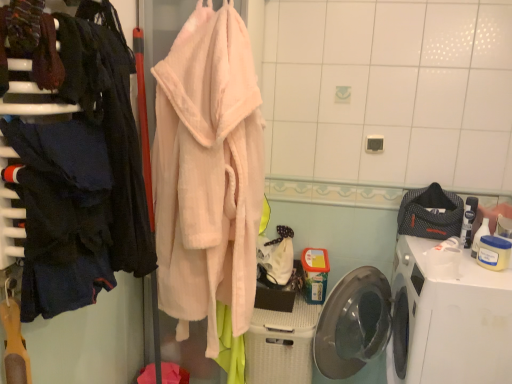
Question: Is white plastic washing machine at lower right inside dark blue fabric at left, marked as the first clothing in a left-to-right arrangement?

Choices:
 (A) yes
 (B) no

Answer: (B)

Question: Is dark blue fabric at left, which ranks as the second clothing in back-to-front order, facing towards white plastic washing machine at lower right?

Choices:
 (A) yes
 (B) no

Answer: (B)

Question: Would you say dark blue fabric at left, the 2th clothing positioned from the right, is outside white plastic washing machine at lower right?

Choices:
 (A) yes
 (B) no

Answer: (A)

Question: Is dark blue fabric at left, marked as the first clothing in a left-to-right arrangement, positioned before white plastic washing machine at lower right?

Choices:
 (A) no
 (B) yes

Answer: (B)

Question: Is dark blue fabric at left, which ranks as the first clothing in front-to-back order, directly adjacent to white plastic washing machine at lower right?

Choices:
 (A) yes
 (B) no

Answer: (B)

Question: Is dark blue fabric at left, the 2th clothing positioned from the right, oriented away from white plastic washing machine at lower right?

Choices:
 (A) no
 (B) yes

Answer: (A)

Question: Does dark blue fabric at left, which is the first closet from front to back, touch soft pink plush robe at center, acting as the 2th closet starting from the front?

Choices:
 (A) yes
 (B) no

Answer: (B)

Question: Is dark blue fabric at left, which is the first closet from front to back, thinner than soft pink plush robe at center, which is counted as the 1th closet, starting from the back?

Choices:
 (A) yes
 (B) no

Answer: (A)

Question: Considering the relative positions of dark blue fabric at left, which is the first closet from front to back, and soft pink plush robe at center, which is counted as the 1th closet, starting from the back, in the image provided, is dark blue fabric at left, which is the first closet from front to back, to the left of soft pink plush robe at center, which is counted as the 1th closet, starting from the back, from the viewer's perspective?

Choices:
 (A) no
 (B) yes

Answer: (B)

Question: Considering the relative sizes of dark blue fabric at left, the second closet when ordered from back to front, and soft pink plush robe at center, which is counted as the 1th closet, starting from the back, in the image provided, is dark blue fabric at left, the second closet when ordered from back to front, wider than soft pink plush robe at center, which is counted as the 1th closet, starting from the back,?

Choices:
 (A) no
 (B) yes

Answer: (A)

Question: Is dark blue fabric at left, which is the first closet from front to back, smaller than soft pink plush robe at center, which is counted as the 1th closet, starting from the back?

Choices:
 (A) no
 (B) yes

Answer: (B)

Question: From the image's perspective, would you say dark blue fabric at left, the second closet when ordered from back to front, is positioned over soft pink plush robe at center, acting as the 2th closet starting from the front?

Choices:
 (A) yes
 (B) no

Answer: (A)

Question: Does white plastic washing machine at lower right appear on the left side of dark blue fabric at left, which is the first closet from front to back?

Choices:
 (A) no
 (B) yes

Answer: (A)